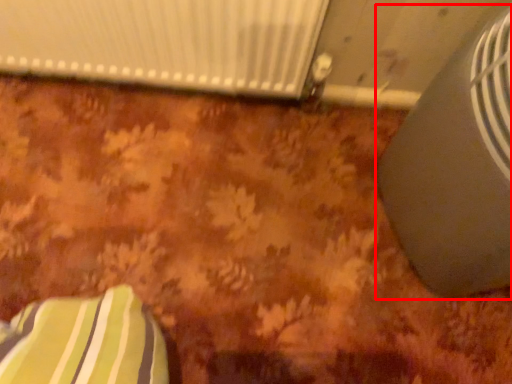
Question: Considering the relative positions of air conditioning (annotated by the red box) and radiator in the image provided, where is air conditioning (annotated by the red box) located with respect to the staircase?

Choices:
 (A) left
 (B) right

Answer: (B)